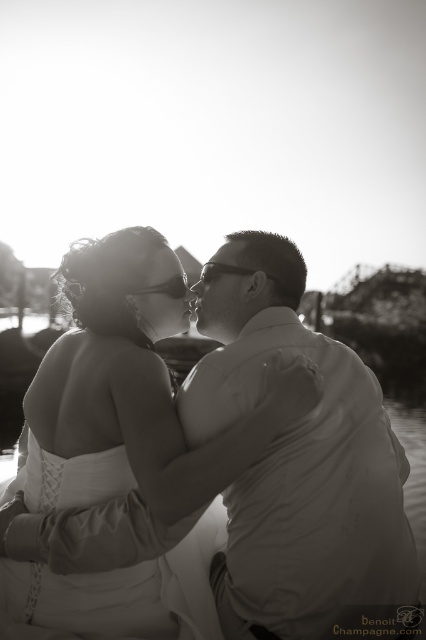
You are a photographer standing 5 meters away from the scene. You want to capture a closeup shot of both the white satin dress at center and the smooth skin forehead at center. Given their distance apart, will your camera frame both subjects in one shot if your camera has a 50mm lens? Explain your answer using the provided details.

The white satin dress at center and smooth skin forehead at center are 11.16 meters apart. Since you are 5 meters away from the scene, the 50mm lens has a field of view similar to human vision, which typically can see about 50 degrees. At 5 meters, the maximum distance covered by the lens would be approximately 6.7 meters. Since 11.16 meters exceeds this, the camera cannot frame both subjects in one shot.

You are an artist sketching this scene. You need to decide which object to focus on first based on their sizes. Which one should you start with, the white satin dress at center or the smooth skin forehead at center?

The white satin dress at center is larger in size than the smooth skin forehead at center, so you should start with the white satin dress at center as it occupies more space in the composition.

Based on the scene described, which object is positioned higher in the image, the smooth cotton shirt at right or the white satin dress at center?

The smooth cotton shirt at right is located above the white satin dress at center, so it is positioned higher in the image.